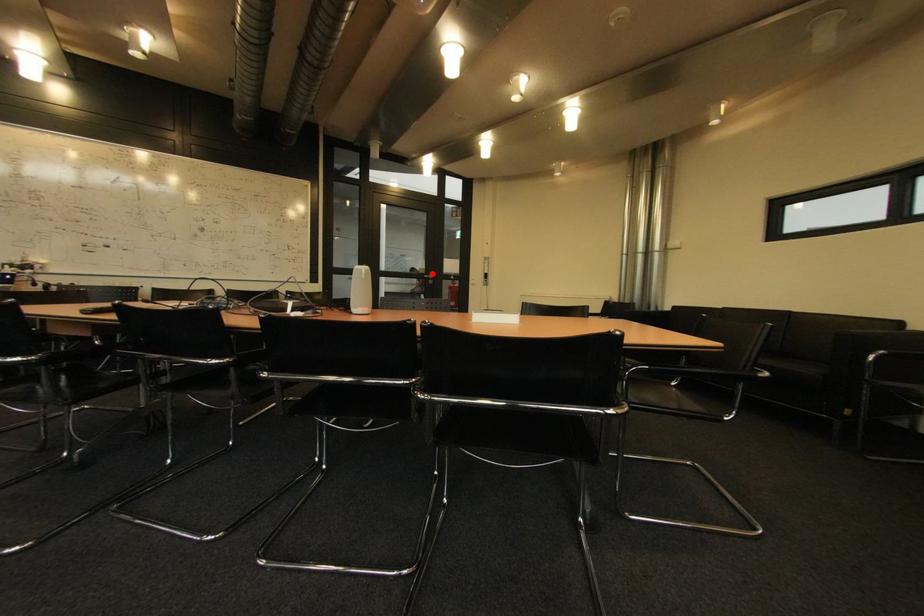
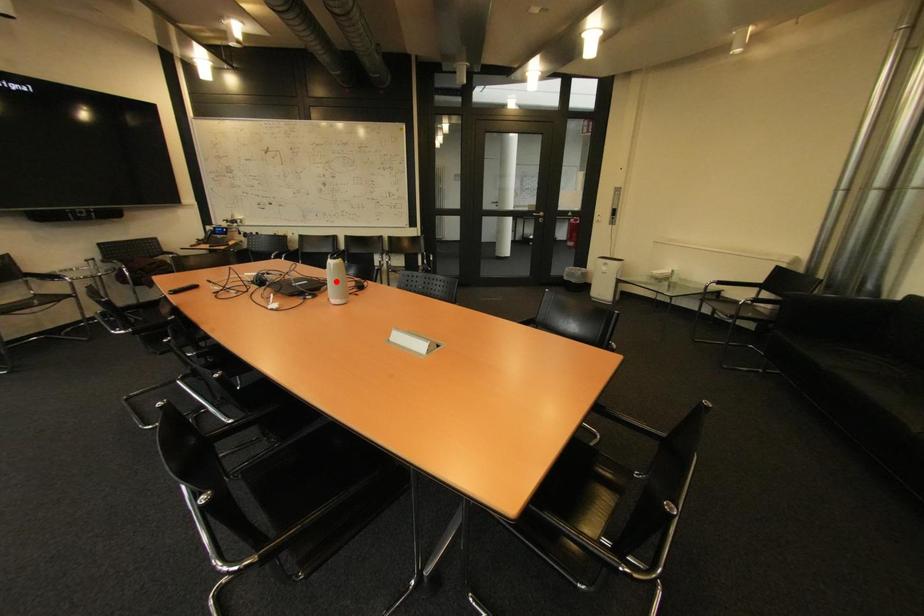
I am providing you with two images of the same scene from different viewpoints. A red point is marked on the first image and another point is marked on the second image. Does the point marked in image1 correspond to the same location as the one in image2?

No